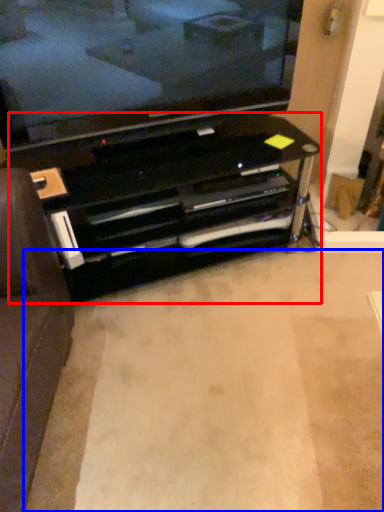
Question: Which object is further to the camera taking this photo, entertainment center (highlighted by a red box) or plain (highlighted by a blue box)?

Choices:
 (A) entertainment center
 (B) plain

Answer: (A)